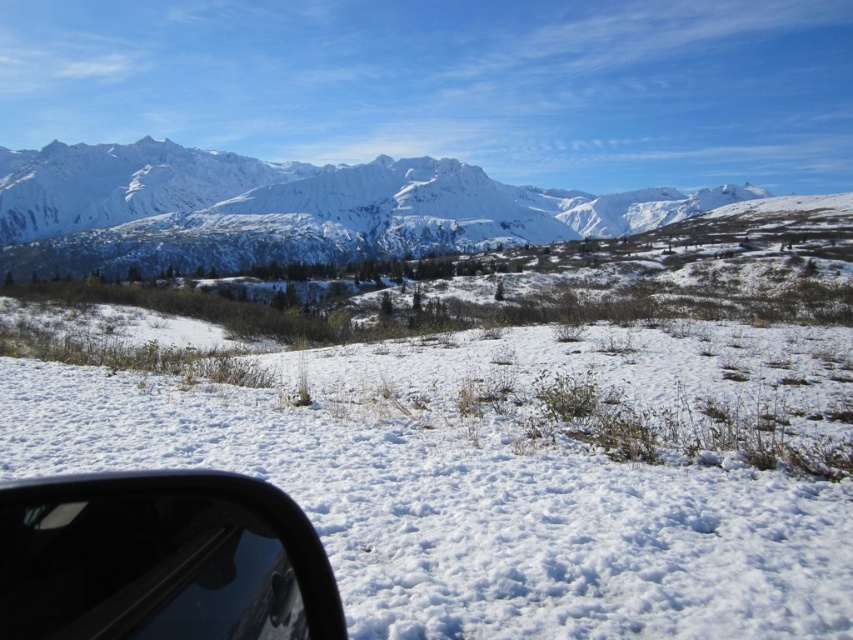
Can you confirm if snowy granite mountain range at upper left is positioned below black matte car window at lower left?

Incorrect, snowy granite mountain range at upper left is not positioned below black matte car window at lower left.

Where is `snowy granite mountain range at upper left`? Image resolution: width=853 pixels, height=640 pixels. snowy granite mountain range at upper left is located at coordinates (286, 209).

What do you see at coordinates (286, 209) in the screenshot? This screenshot has width=853, height=640. I see `snowy granite mountain range at upper left` at bounding box center [286, 209].

Where is `snowy granite mountain range at upper left`? The height and width of the screenshot is (640, 853). snowy granite mountain range at upper left is located at coordinates (286, 209).

Is white fluffy snow at center below snowy granite mountain range at upper left?

Correct, white fluffy snow at center is located below snowy granite mountain range at upper left.

The height and width of the screenshot is (640, 853). What are the coordinates of `white fluffy snow at center` in the screenshot? It's located at (500, 465).

Is white fluffy snow at center in front of black matte car window at lower left?

No, white fluffy snow at center is further to the viewer.

Is point (682, 476) more distant than point (61, 513)?

That is True.

Where is `white fluffy snow at center`? The width and height of the screenshot is (853, 640). white fluffy snow at center is located at coordinates (500, 465).